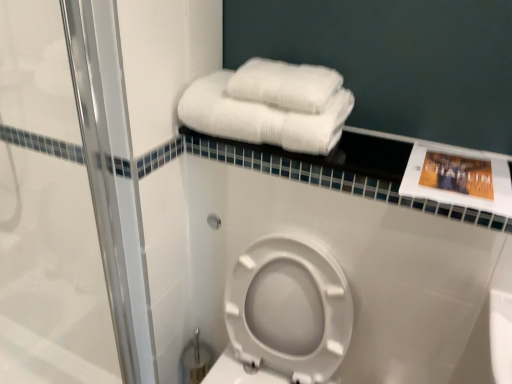
Question: Is white fluffy towels at upper center, which appears as the second towel when ordered from the bottom, positioned with its back to white plastic toilet at lower center?

Choices:
 (A) yes
 (B) no

Answer: (B)

Question: Is white fluffy towels at upper center, which ranks as the 1th towel in top-to-bottom order, not near white plastic toilet at lower center?

Choices:
 (A) yes
 (B) no

Answer: (B)

Question: Can you confirm if white fluffy towels at upper center, which appears as the second towel when ordered from the bottom, is taller than white plastic toilet at lower center?

Choices:
 (A) no
 (B) yes

Answer: (A)

Question: From a real-world perspective, is white fluffy towels at upper center, which ranks as the 1th towel in top-to-bottom order, physically above white plastic toilet at lower center?

Choices:
 (A) yes
 (B) no

Answer: (A)

Question: Is white fluffy towels at upper center, which ranks as the 1th towel in top-to-bottom order, aimed at white plastic toilet at lower center?

Choices:
 (A) no
 (B) yes

Answer: (A)

Question: From the image's perspective, is white fluffy towels at upper center, which ranks as the 1th towel in top-to-bottom order, located above or below clear glass shower door at left?

Choices:
 (A) below
 (B) above

Answer: (B)

Question: Is white fluffy towels at upper center, which appears as the second towel when ordered from the bottom, spatially inside clear glass shower door at left, or outside of it?

Choices:
 (A) inside
 (B) outside

Answer: (B)

Question: Is white fluffy towels at upper center, which ranks as the 1th towel in top-to-bottom order, wider or thinner than clear glass shower door at left?

Choices:
 (A) wide
 (B) thin

Answer: (A)

Question: Is white fluffy towels at upper center, which ranks as the 1th towel in top-to-bottom order, bigger or smaller than clear glass shower door at left?

Choices:
 (A) small
 (B) big

Answer: (A)

Question: In the image, is white glossy towel rack at upper center on the left side or the right side of clear glass shower door at left?

Choices:
 (A) right
 (B) left

Answer: (A)

Question: Is white glossy towel rack at upper center spatially inside clear glass shower door at left, or outside of it?

Choices:
 (A) outside
 (B) inside

Answer: (A)

Question: Considering their positions, is white glossy towel rack at upper center located in front of or behind clear glass shower door at left?

Choices:
 (A) behind
 (B) front

Answer: (A)

Question: Looking at their shapes, would you say white glossy towel rack at upper center is wider or thinner than clear glass shower door at left?

Choices:
 (A) wide
 (B) thin

Answer: (A)

Question: From a real-world perspective, relative to white fluffy towels at upper center, which appears as the second towel when ordered from the bottom, is white fluffy towels at upper right, the 2th towel when ordered from top to bottom, vertically above or below?

Choices:
 (A) below
 (B) above

Answer: (A)

Question: Visually, is white fluffy towels at upper right, which is counted as the 1th towel, starting from the bottom, positioned to the left or to the right of white fluffy towels at upper center, which appears as the second towel when ordered from the bottom?

Choices:
 (A) left
 (B) right

Answer: (A)